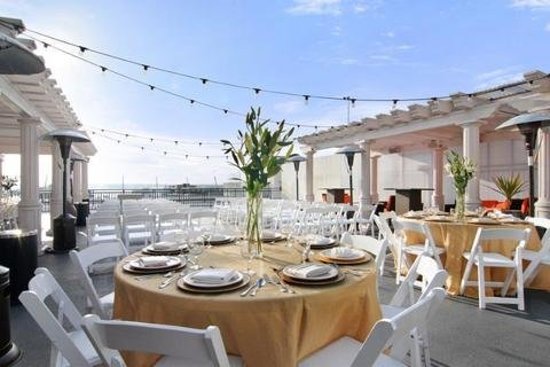
Locate an element on the screen. silverware is located at coordinates (163, 286), (167, 277), (245, 291), (250, 291), (279, 293), (291, 290), (358, 274), (291, 241).